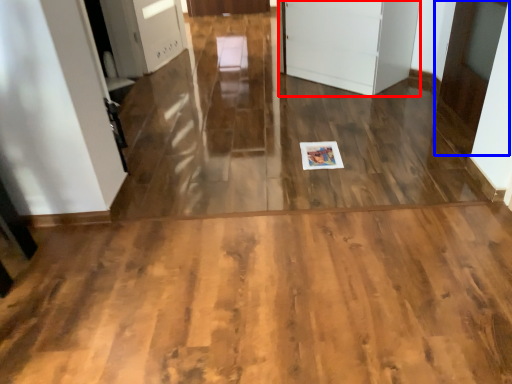
Question: Among these objects, which one is farthest to the camera, door (highlighted by a red box) or door (highlighted by a blue box)?

Choices:
 (A) door
 (B) door

Answer: (A)